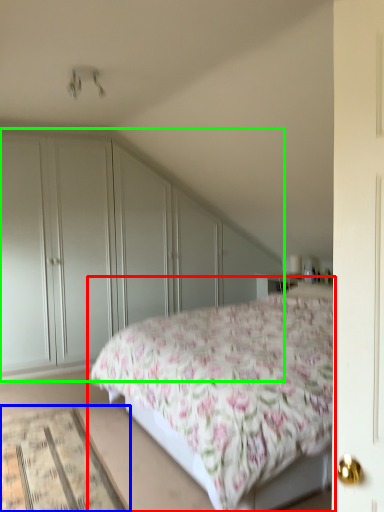
Question: Based on their relative distances, which object is nearer to bed (highlighted by a red box)? Choose from mat (highlighted by a blue box) and dresser (highlighted by a green box).

Choices:
 (A) mat
 (B) dresser

Answer: (A)